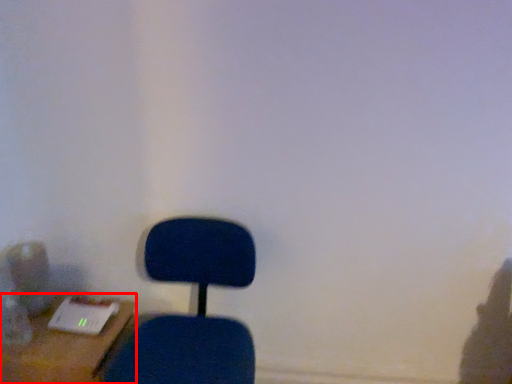
Question: From the image's perspective, what is the correct spatial relationship of furniture (annotated by the red box) in relation to chair?

Choices:
 (A) below
 (B) above

Answer: (A)